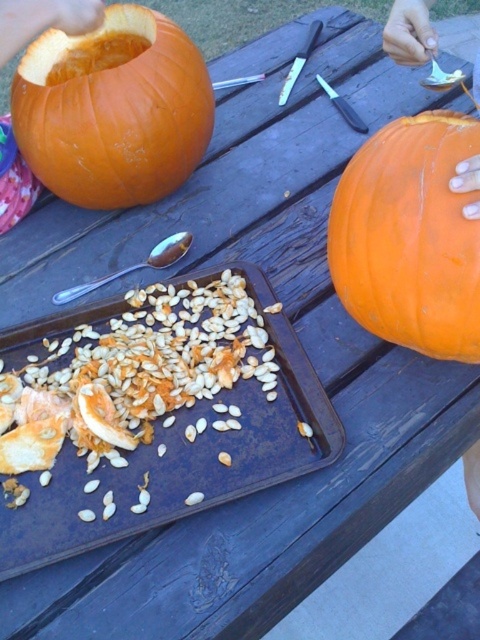
Please look at the image and tell me what object is located at the coordinates point (180, 465)?

The metallic baking tray at center is located at point (180, 465).

From the picture: You are at a pumpkin carving station and need to reach the orange matte pumpkin at right. However, the orange matte pumpkin at upper left is blocking your path. Can you move around it to access the one you need?

The orange matte pumpkin at right is behind the orange matte pumpkin at upper left, so you can move around the orange matte pumpkin at upper left to access the orange matte pumpkin at right.

From the picture: You are preparing to place both the metallic baking tray at center and the orange matte pumpkin at right onto a shelf. The shelf has limited space, and you need to know which item takes up more space. Which object is bigger?

The metallic baking tray at center is larger in size than the orange matte pumpkin at right, so the metallic baking tray at center takes up more space.